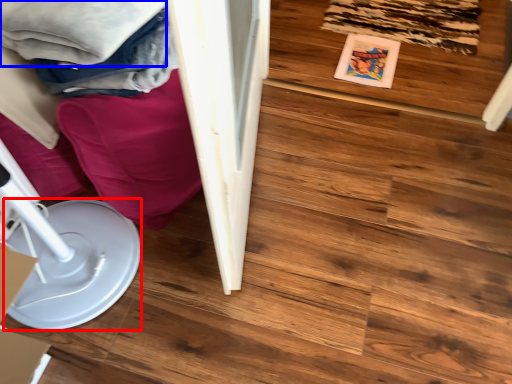
Question: Among these objects, which one is nearest to the camera, paper plate (highlighted by a red box) or clothing (highlighted by a blue box)?

Choices:
 (A) paper plate
 (B) clothing

Answer: (A)